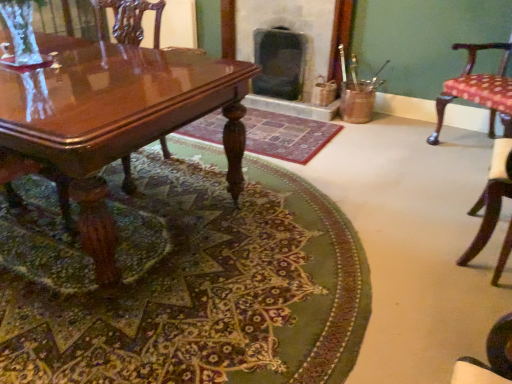
Question: Does dark gray stone fireplace at center, arranged as the 2th fireplace when viewed from the right, have a greater height compared to glossy wood chair at left, the third chair from the right?

Choices:
 (A) yes
 (B) no

Answer: (B)

Question: Is the depth of dark gray stone fireplace at center, arranged as the 2th fireplace when viewed from the right, less than that of glossy wood chair at left, the third chair from the right?

Choices:
 (A) no
 (B) yes

Answer: (A)

Question: Can you confirm if dark gray stone fireplace at center, arranged as the 2th fireplace when viewed from the right, is positioned to the left of glossy wood chair at left, the third chair from the right?

Choices:
 (A) no
 (B) yes

Answer: (A)

Question: From the image's perspective, would you say dark gray stone fireplace at center, arranged as the 2th fireplace when viewed from the right, is shown under glossy wood chair at left, placed as the first chair when sorted from left to right?

Choices:
 (A) no
 (B) yes

Answer: (A)

Question: Considering the relative sizes of dark gray stone fireplace at center, arranged as the 2th fireplace when viewed from the right, and glossy wood chair at left, the third chair from the right, in the image provided, is dark gray stone fireplace at center, arranged as the 2th fireplace when viewed from the right, bigger than glossy wood chair at left, the third chair from the right,?

Choices:
 (A) yes
 (B) no

Answer: (B)

Question: Considering the relative sizes of dark gray stone fireplace at center, the first fireplace when ordered from left to right, and glossy wood chair at left, the third chair from the right, in the image provided, is dark gray stone fireplace at center, the first fireplace when ordered from left to right, smaller than glossy wood chair at left, the third chair from the right,?

Choices:
 (A) yes
 (B) no

Answer: (A)

Question: Can you confirm if green woven rug at center, positioned as the 2th mat in front-to-back order, is wider than carpeted floor at center, placed as the 2th mat when sorted from back to front?

Choices:
 (A) no
 (B) yes

Answer: (A)

Question: Considering the relative positions of green woven rug at center, placed as the first mat when sorted from back to front, and carpeted floor at center, which is counted as the first mat, starting from the front, in the image provided, is green woven rug at center, placed as the first mat when sorted from back to front, to the right of carpeted floor at center, which is counted as the first mat, starting from the front, from the viewer's perspective?

Choices:
 (A) yes
 (B) no

Answer: (A)

Question: Does green woven rug at center, placed as the first mat when sorted from back to front, come in front of carpeted floor at center, placed as the 2th mat when sorted from back to front?

Choices:
 (A) no
 (B) yes

Answer: (A)

Question: Is green woven rug at center, positioned as the 2th mat in front-to-back order, turned away from carpeted floor at center, placed as the 2th mat when sorted from back to front?

Choices:
 (A) yes
 (B) no

Answer: (B)

Question: Is carpeted floor at center, which is counted as the first mat, starting from the front, located within green woven rug at center, placed as the first mat when sorted from back to front?

Choices:
 (A) yes
 (B) no

Answer: (B)

Question: Can you confirm if green woven rug at center, placed as the first mat when sorted from back to front, is bigger than carpeted floor at center, placed as the 2th mat when sorted from back to front?

Choices:
 (A) no
 (B) yes

Answer: (A)

Question: From a real-world perspective, is dark gray stone fireplace at center, the second fireplace from the left, on patterned fabric cushion at right, which appears as the 2th chair when viewed from the left?

Choices:
 (A) no
 (B) yes

Answer: (A)